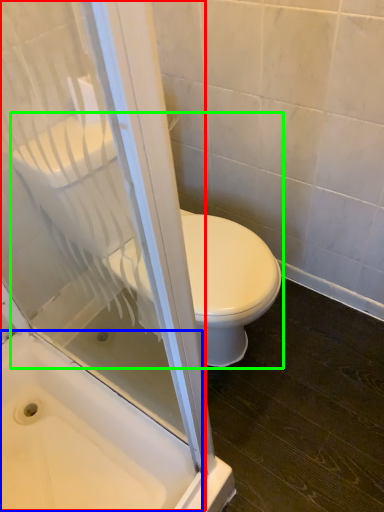
Question: Estimate the real-world distances between objects in this image. Which object is farther from screen door (highlighted by a red box), bath (highlighted by a blue box) or toilet (highlighted by a green box)?

Choices:
 (A) bath
 (B) toilet

Answer: (B)